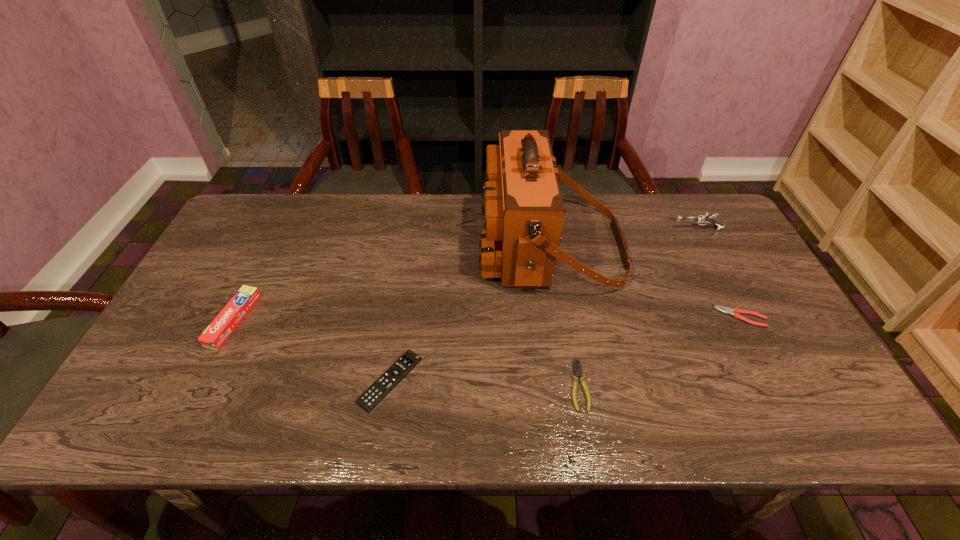
The width and height of the screenshot is (960, 540). What are the coordinates of `unoccupied position between the right pliers and the remote control` in the screenshot? It's located at (565, 349).

Identify the location of free space that is in between the second object from left to right and the left pliers. (485, 383).

The height and width of the screenshot is (540, 960). What are the coordinates of `object that is the third closest to the toothpaste` in the screenshot? It's located at (577, 372).

Locate an element on the screen. The height and width of the screenshot is (540, 960). object that is the second closest to the nearer pliers is located at coordinates pos(390,378).

Where is `vacant space that satisfies the following two spatial constraints: 1. aimed along the barrel of the second tallest object; 2. on the front side of the second object from left to right`? The width and height of the screenshot is (960, 540). vacant space that satisfies the following two spatial constraints: 1. aimed along the barrel of the second tallest object; 2. on the front side of the second object from left to right is located at coordinates (779, 380).